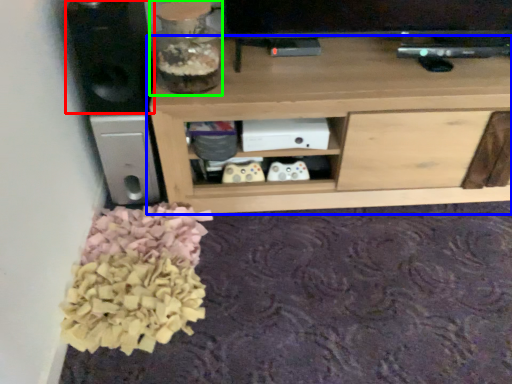
Question: Considering the real-world distances, which object is closest to speaker (highlighted by a red box)? shelf (highlighted by a blue box) or glass vase (highlighted by a green box).

Choices:
 (A) shelf
 (B) glass vase

Answer: (B)